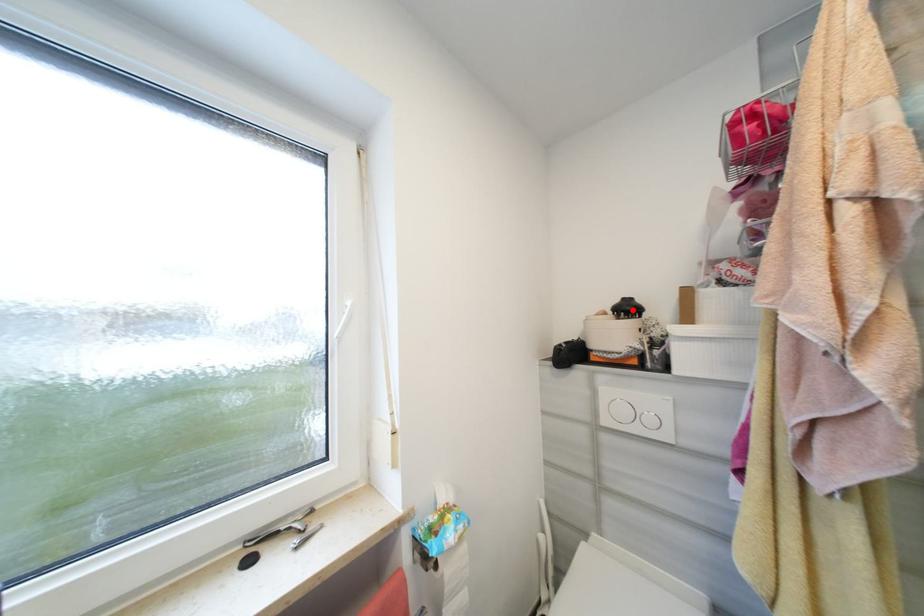
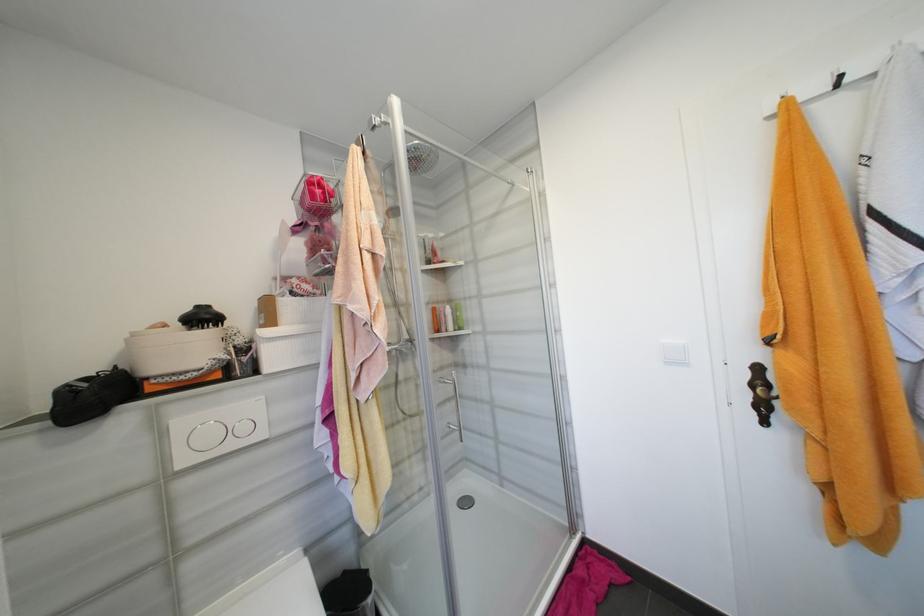
Locate, in the second image, the point that corresponds to the highlighted location in the first image.

(210, 318)